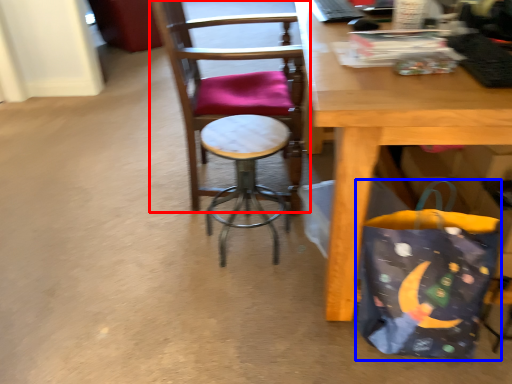
Question: Which object appears closest to the camera in this image, chair (highlighted by a red box) or grocery bag (highlighted by a blue box)?

Choices:
 (A) chair
 (B) grocery bag

Answer: (B)